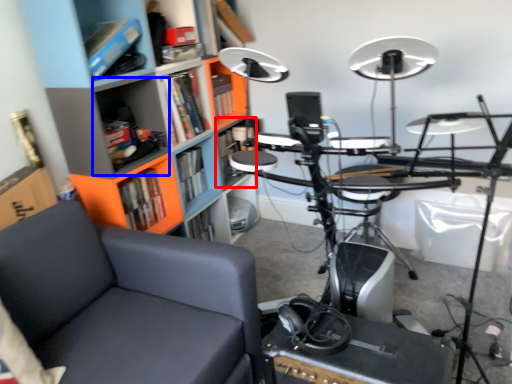
Question: Among these objects, which one is farthest to the camera, shelf (highlighted by a red box) or shelf (highlighted by a blue box)?

Choices:
 (A) shelf
 (B) shelf

Answer: (A)